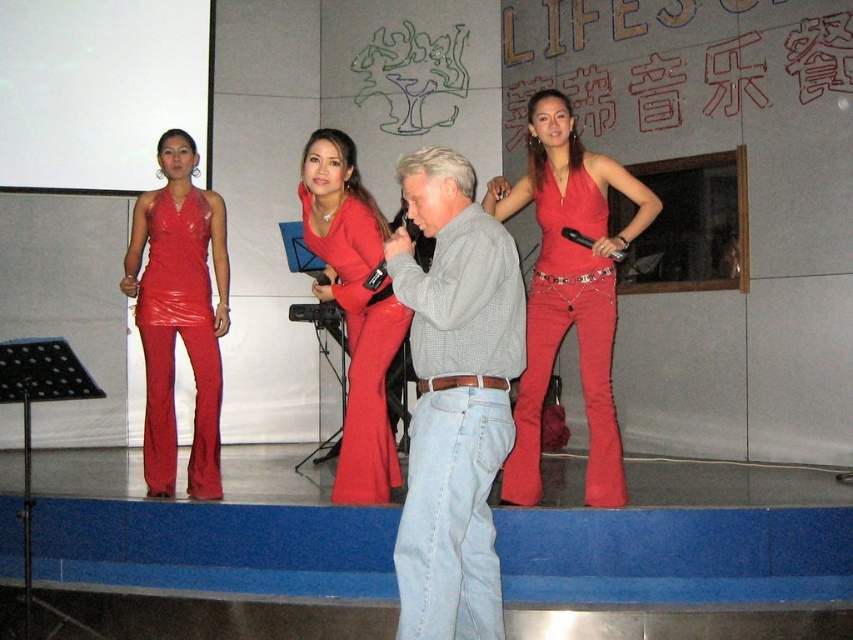
Question: Can you confirm if light blue fabric stage at center is positioned below gray checkered shirt at center?

Choices:
 (A) yes
 (B) no

Answer: (A)

Question: Is light blue fabric stage at center wider than shiny red dress at center?

Choices:
 (A) yes
 (B) no

Answer: (A)

Question: Based on their relative distances, which object is farther from the gray checkered shirt at center?

Choices:
 (A) matte red jumpsuit at center
 (B) shiny red dress at center
 (C) shiny red dress at left
 (D) light blue fabric stage at center

Answer: (C)

Question: Which of these objects is positioned farthest from the shiny red dress at left?

Choices:
 (A) redtexturedwall at upper center
 (B) shiny red dress at center

Answer: (A)

Question: Among these points, which one is farthest from the camera?

Choices:
 (A) (67, 580)
 (B) (538, 456)

Answer: (A)

Question: Observing the image, what is the correct spatial positioning of gray checkered shirt at center in reference to matte red jumpsuit at center?

Choices:
 (A) below
 (B) above

Answer: (A)